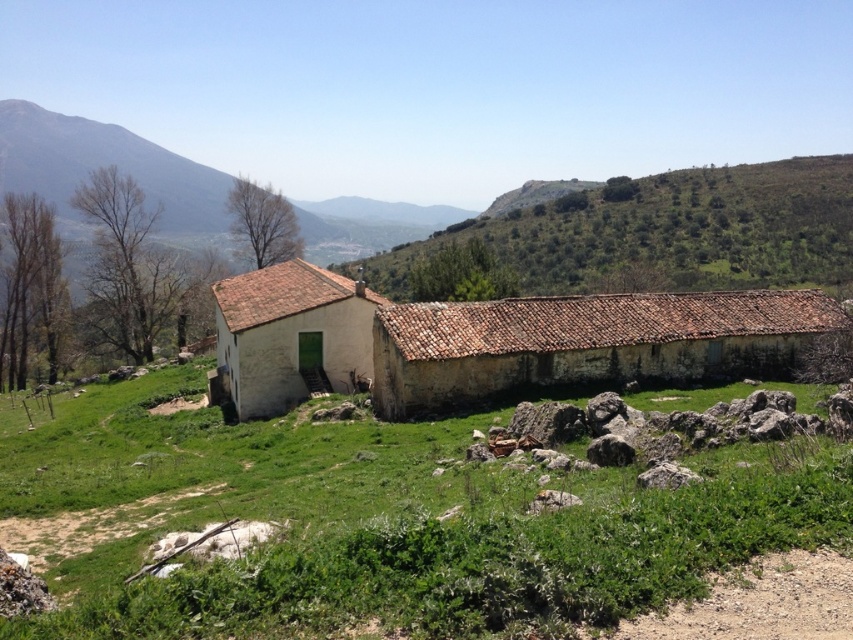
You are standing at the entrance of the farm and want to locate the white clay barn at center. According to the coordinates provided, where exactly should you look to find it?

The white clay barn at center is located at coordinates point [489,339].

You are standing at the starting point of the dirt path leading to the rustic building. You see two points marked on the dirt path. One is at point (538,472) and the other at point (270,275). Which point is closer to you?

Point (538,472) is in front of point (270,275), so the point closer to you is point (538,472).

You are a farmer planning to place a new storage shed between the white clay barn at center and the white matte house at center. Based on their widths, which one should you place the shed closer to?

The white clay barn at center might be wider than the white matte house at center, so placing the shed closer to the white clay barn at center would be more appropriate to ensure adequate space.